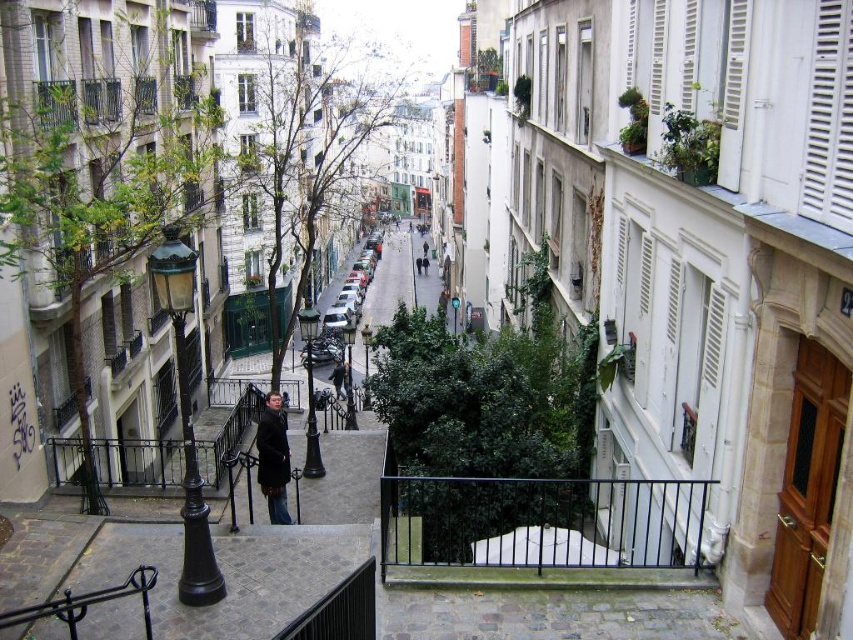
You are standing at the bottom of the street looking up. There is a point marked at coordinates (x=828, y=120). What object does this point indicate?

The point at coordinates (x=828, y=120) marks the white louvered shutter at upper right.

You are a tourist standing on a balcony looking down at the street below. You notice a black metal balustrade at center and a white louvered shutter at upper right. Which object appears bigger in your view?

The black metal balustrade at center appears bigger in your view because it is larger in size than the white louvered shutter at upper right.

You are standing at the point with coordinates point (260, 451) and want to walk towards the point with coordinates point (825, 221). Given the street layout described, will you be moving towards the direction of the buildings or away from them?

Since point (825, 221) is in front of point (260, 451), you are moving towards the direction of the buildings.